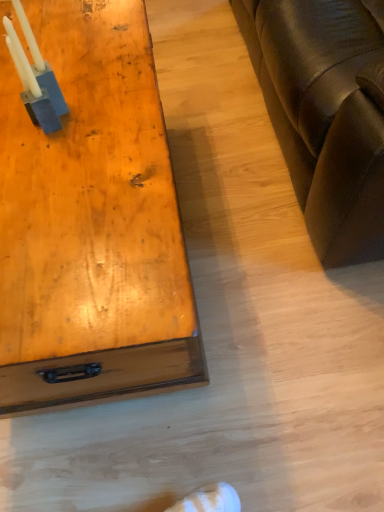
Identify the location of vacant space situated above wooden table at left (from a real-world perspective). (61, 129).